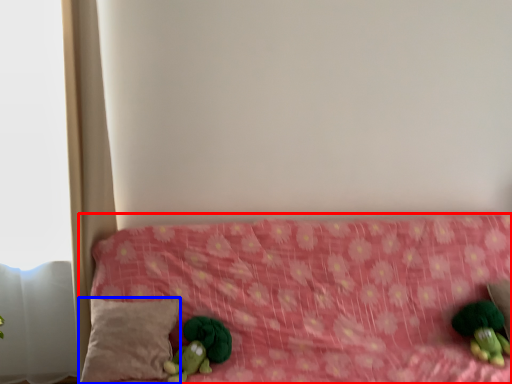
Question: Which object appears farthest to the camera in this image, furniture (highlighted by a red box) or pillow (highlighted by a blue box)?

Choices:
 (A) furniture
 (B) pillow

Answer: (B)